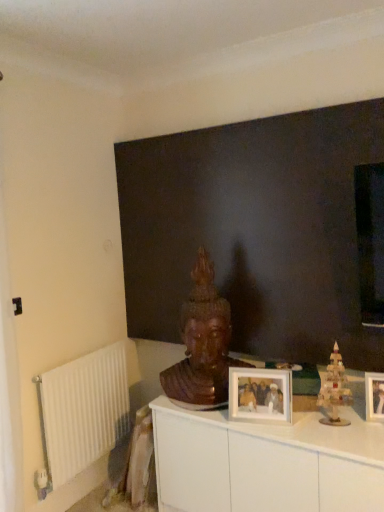
Question: Is wooden statue at center in front of or behind wooden picture frame at center, acting as the second picture frame starting from the left, in the image?

Choices:
 (A) behind
 (B) front

Answer: (A)

Question: Is wooden statue at center inside the boundaries of wooden picture frame at center, the 1th picture frame viewed from the right, or outside?

Choices:
 (A) inside
 (B) outside

Answer: (B)

Question: Based on their relative distances, which object is nearer to the wooden picture frame at center, acting as the second picture frame starting from the left?

Choices:
 (A) wooden statue at center
 (B) white glossy cabinet at center
 (C) white matte picture frame at center, arranged as the 1th picture frame when viewed from the left
 (D) white metallic radiator at left
 (E) dark matte wall at center

Answer: (C)

Question: Estimate the real-world distances between objects in this image. Which object is closer to the wooden christmas tree at right?

Choices:
 (A) white metallic radiator at left
 (B) white glossy cabinet at center
 (C) wooden picture frame at center, acting as the second picture frame starting from the left
 (D) wooden statue at center
 (E) white matte picture frame at center, arranged as the 1th picture frame when viewed from the left

Answer: (C)